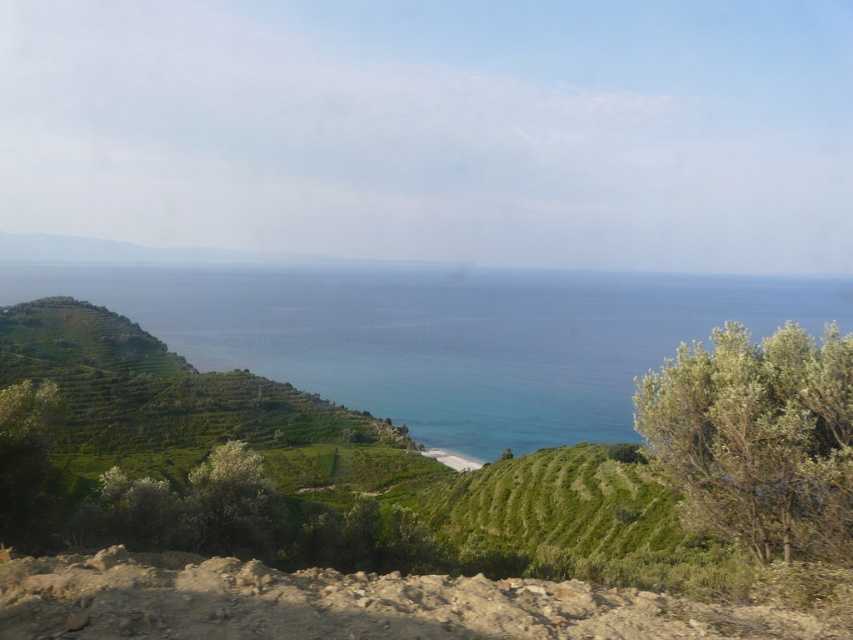
Between blue clear water at center and brown dirt at lower left, which one appears on the right side from the viewer's perspective?

Positioned to the right is brown dirt at lower left.

Can you confirm if blue clear water at center is taller than brown dirt at lower left?

Indeed, blue clear water at center has a greater height compared to brown dirt at lower left.

Locate an element on the screen. The height and width of the screenshot is (640, 853). blue clear water at center is located at coordinates (444, 337).

Can you confirm if blue clear water at center is positioned below green leafy bush at right?

No, blue clear water at center is not below green leafy bush at right.

The image size is (853, 640). I want to click on blue clear water at center, so click(x=444, y=337).

Is point (213, 628) in front of point (834, 349)?

Yes, it is.

Measure the distance between brown dirt at lower left and camera.

brown dirt at lower left and camera are 14.25 feet apart from each other.

Is point (657, 593) positioned after point (830, 380)?

That is False.

This screenshot has height=640, width=853. Identify the location of brown dirt at lower left. (347, 604).